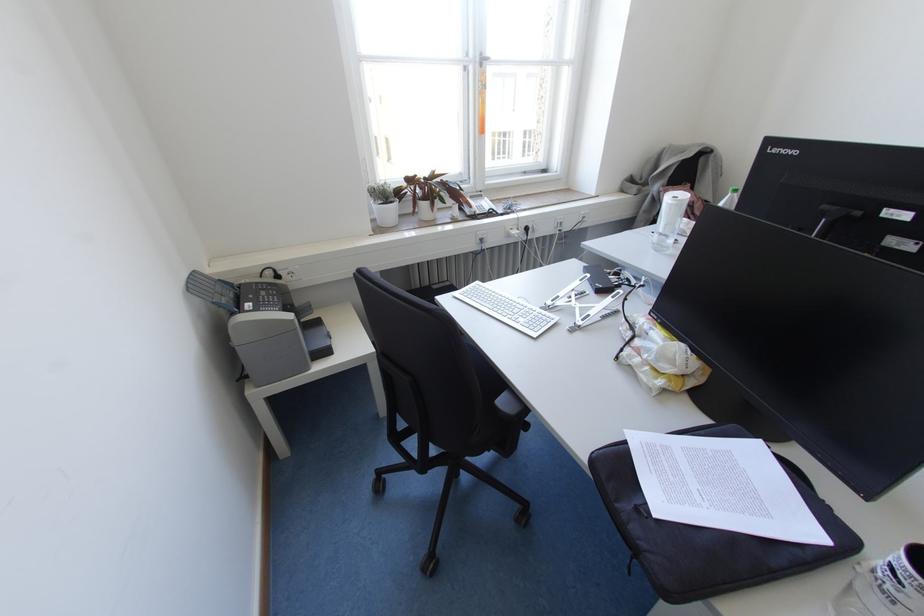
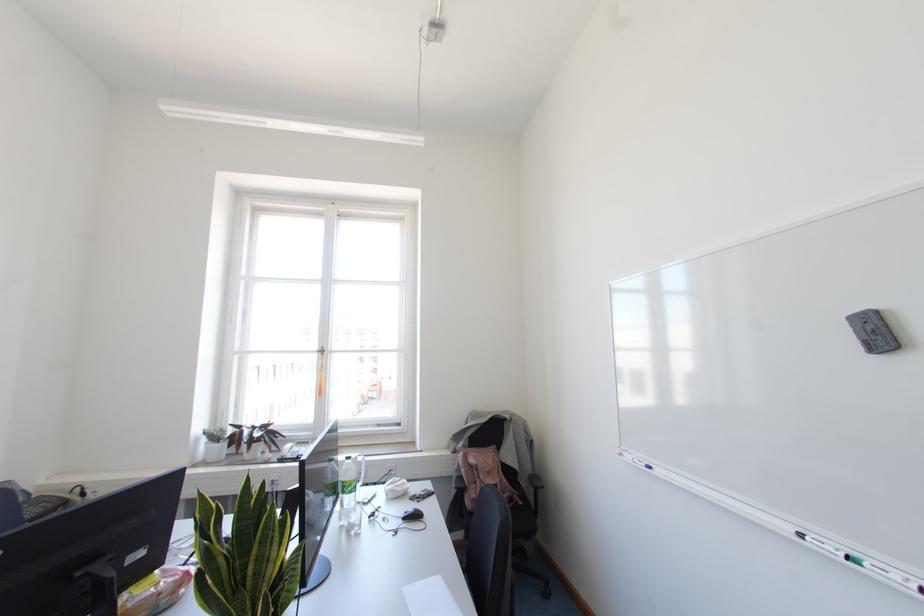
Where in the second image is the point corresponding to pixel 480 65 from the first image?

(322, 353)